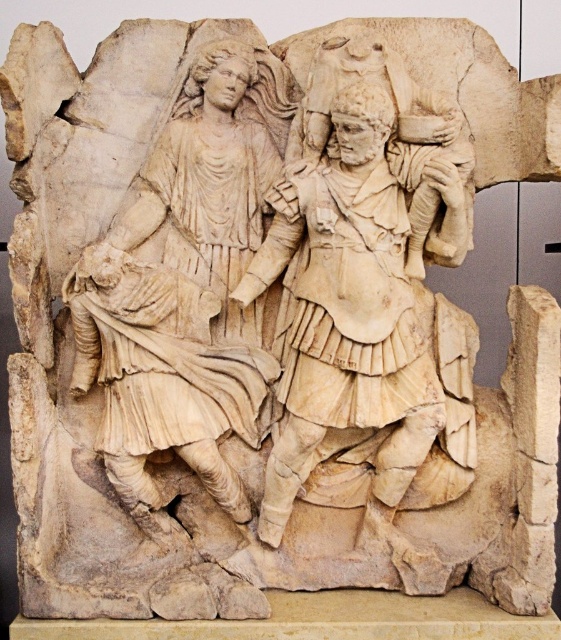
Is white marble figure at center wider than white marble warrior at center?

No.

Can you confirm if white marble figure at center is positioned to the right of white marble warrior at center?

Incorrect, white marble figure at center is not on the right side of white marble warrior at center.

The image size is (561, 640). Describe the element at coordinates (186, 288) in the screenshot. I see `white marble figure at center` at that location.

The width and height of the screenshot is (561, 640). Identify the location of white marble figure at center. (186, 288).